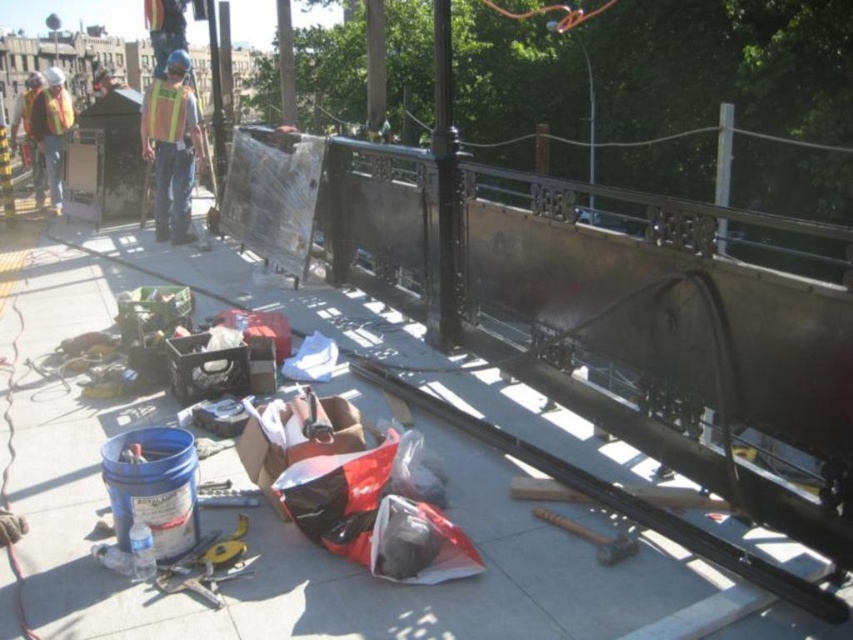
Which is more to the right, plastic bucket at lower left or reflective safety vest at left?

plastic bucket at lower left

The width and height of the screenshot is (853, 640). Identify the location of plastic bucket at lower left. (415, 532).

Is the position of metallic gray pavement at center less distant than that of reflective safety vest at left?

That is True.

Which is below, metallic gray pavement at center or reflective safety vest at left?

metallic gray pavement at center is below.

Locate an element on the screen. metallic gray pavement at center is located at coordinates (289, 524).

Can you confirm if plastic bucket at lower left is positioned above yellow reflective vest at center?

Incorrect, plastic bucket at lower left is not positioned above yellow reflective vest at center.

Describe the element at coordinates (415, 532) in the screenshot. I see `plastic bucket at lower left` at that location.

This screenshot has height=640, width=853. In order to click on plastic bucket at lower left in this screenshot , I will do `click(415, 532)`.